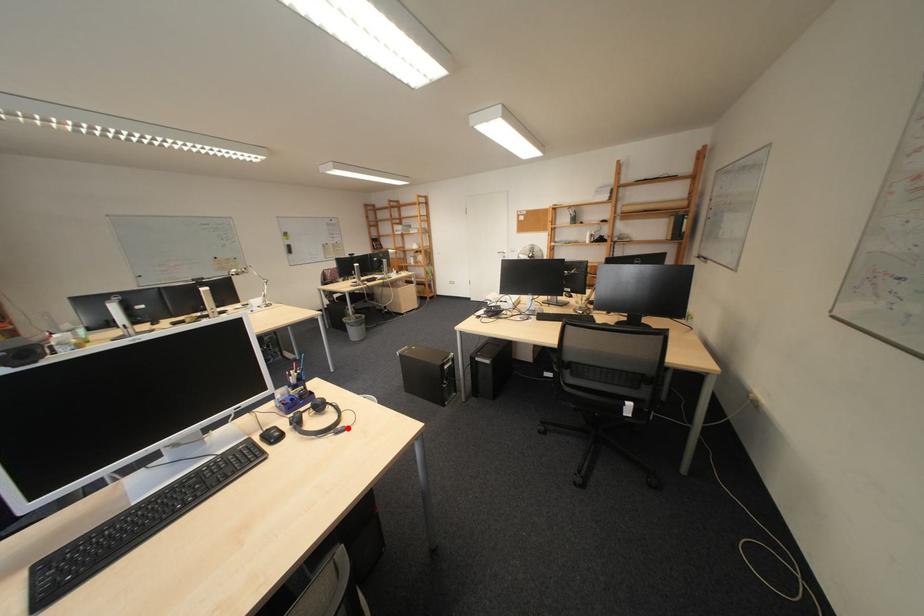
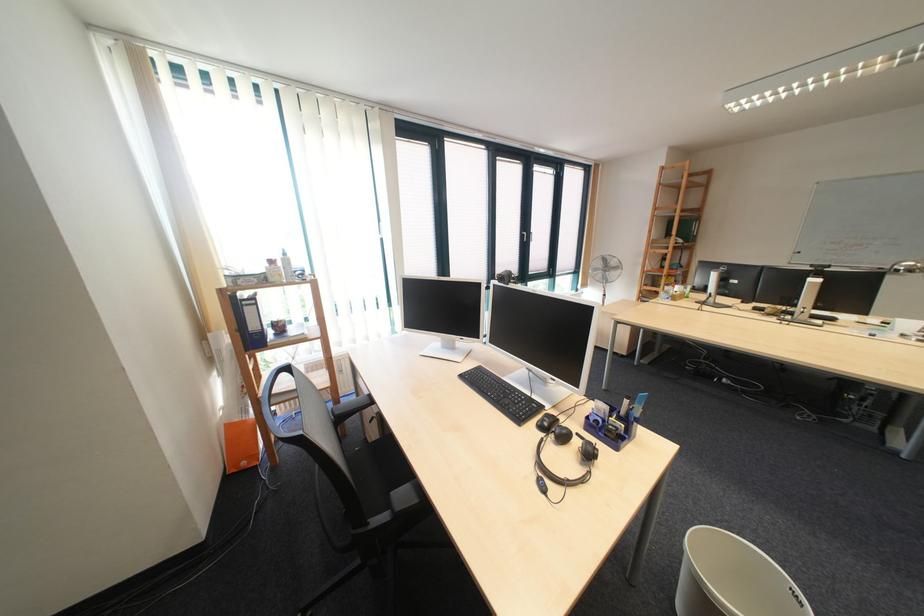
In the second image, find the point that corresponds to the highlighted location in the first image.

(563, 476)